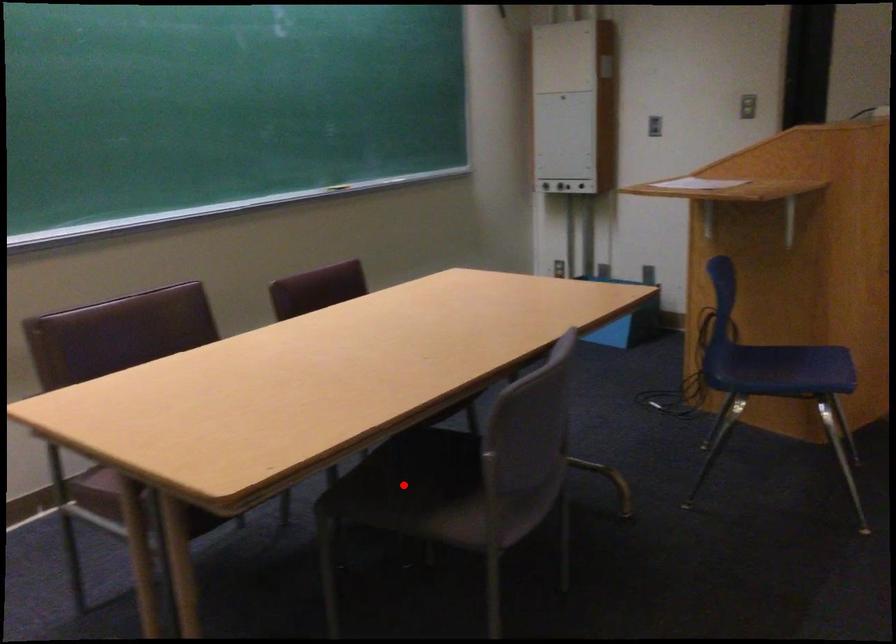
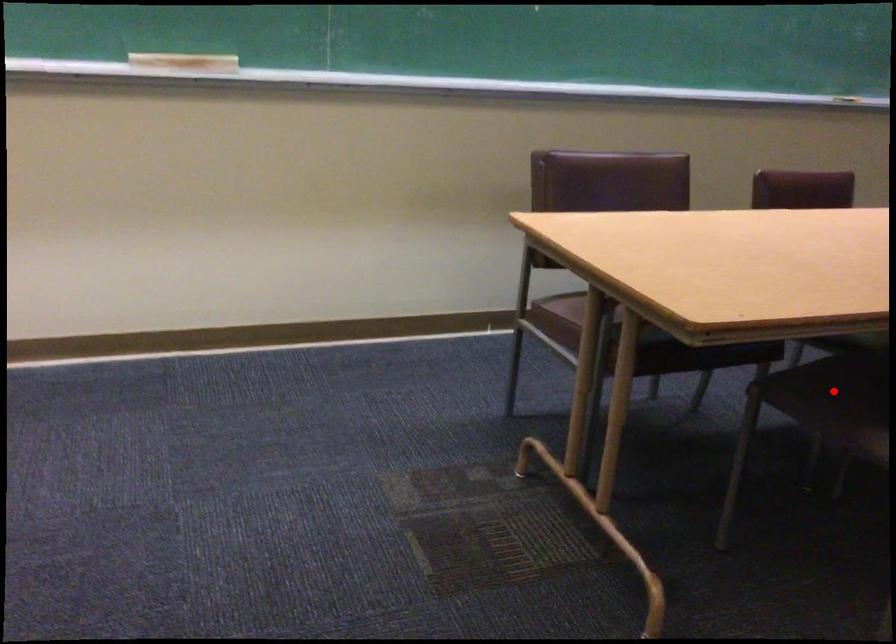
I am providing you with two images of the same scene from different viewpoints. A red point is marked on the first image and another point is marked on the second image. Does the point marked in image1 correspond to the same location as the one in image2?

Yes